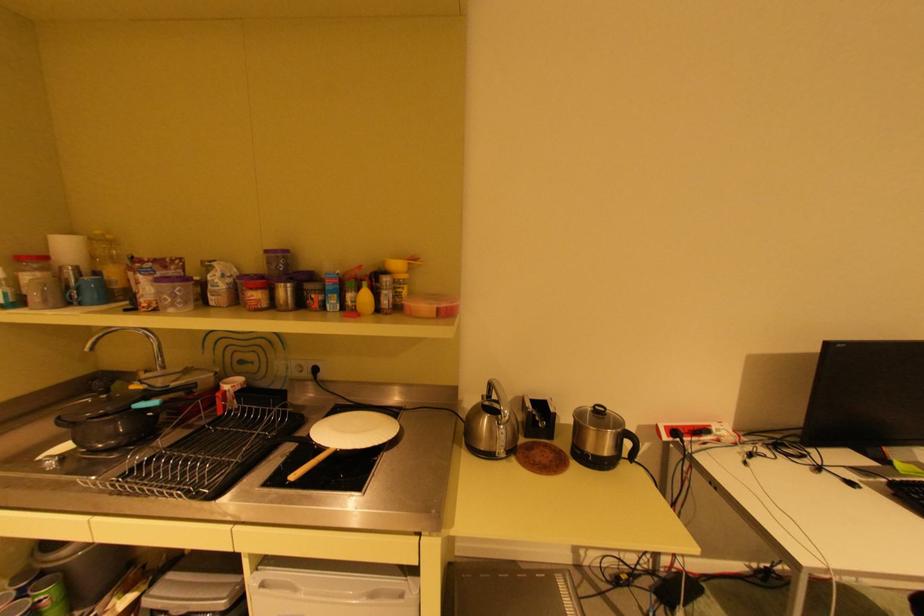
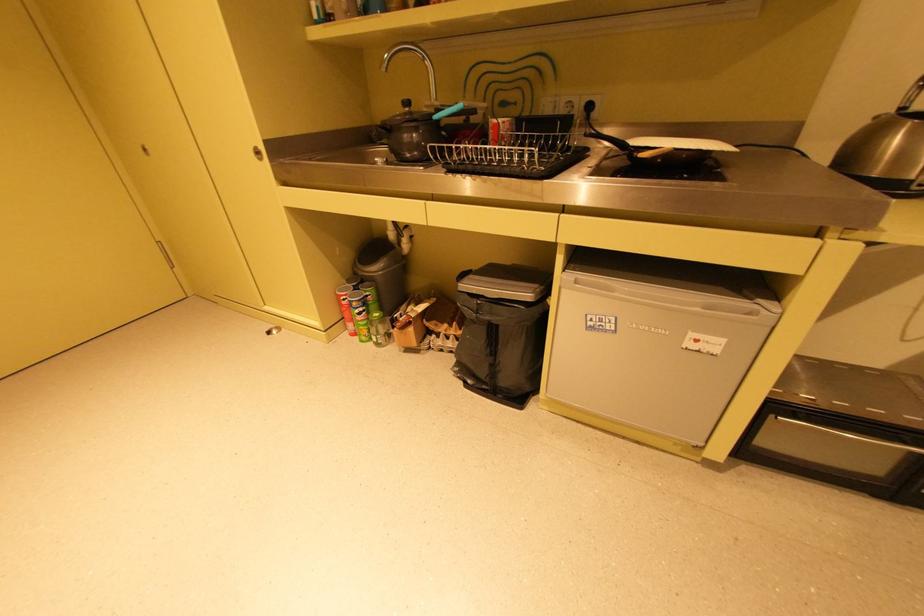
The images are taken continuously from a first-person perspective. In which direction is your viewpoint rotating?

The camera's rotation is toward left-down.